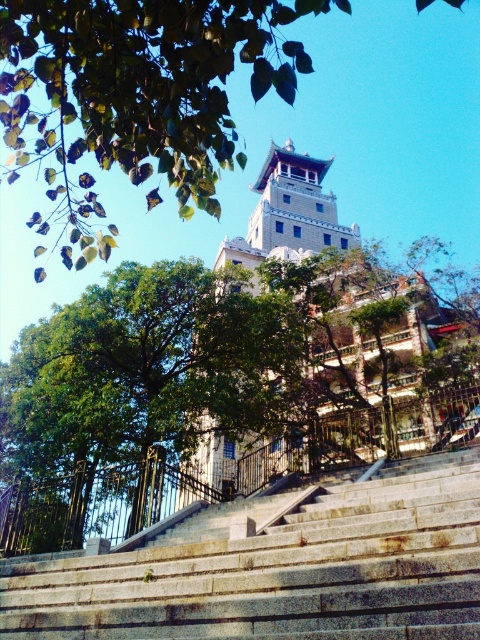
Is gray stone stairs at center wider than green leafy tree at center?

Incorrect, gray stone stairs at center's width does not surpass green leafy tree at center's.

Is point (349, 490) positioned in front of point (233, 285)?

Yes, it is in front of point (233, 285).

Where is `gray stone stairs at center`? The image size is (480, 640). gray stone stairs at center is located at coordinates (277, 568).

Identify the location of gray stone stairs at center. (277, 568).

Between point (400, 464) and point (291, 52), which one is positioned behind?

Point (400, 464)

Is point (144, 561) positioned before point (74, 29)?

No, (144, 561) is further to viewer.

Does point (97, 580) lie behind point (132, 173)?

Yes, point (97, 580) is farther from viewer.

Locate an element on the screen. gray stone stairs at center is located at coordinates (277, 568).

Who is lower down, green leafy tree at center or green leafy tree at upper center?

green leafy tree at center is lower down.

Which of these two, green leafy tree at center or green leafy tree at upper center, stands shorter?

green leafy tree at center is shorter.

This screenshot has width=480, height=640. Describe the element at coordinates (134, 396) in the screenshot. I see `green leafy tree at center` at that location.

At what (x,y) coordinates should I click in order to perform the action: click on green leafy tree at center. Please return your answer as a coordinate pair (x, y). Looking at the image, I should click on (134, 396).